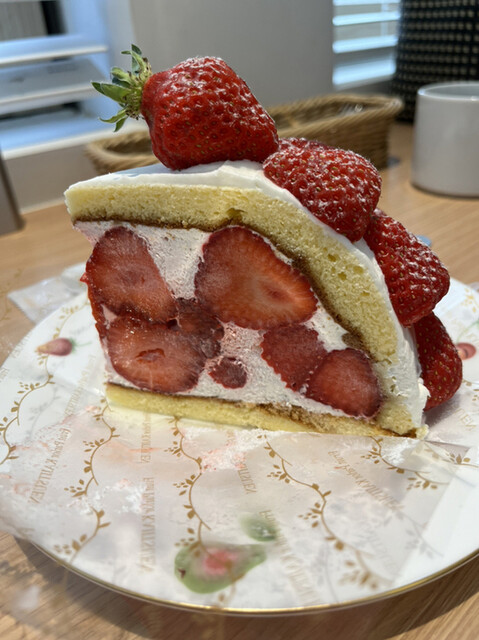
Find the location of a particular element. Image resolution: width=479 pixels, height=640 pixels. woven basket is located at coordinates (375, 131).